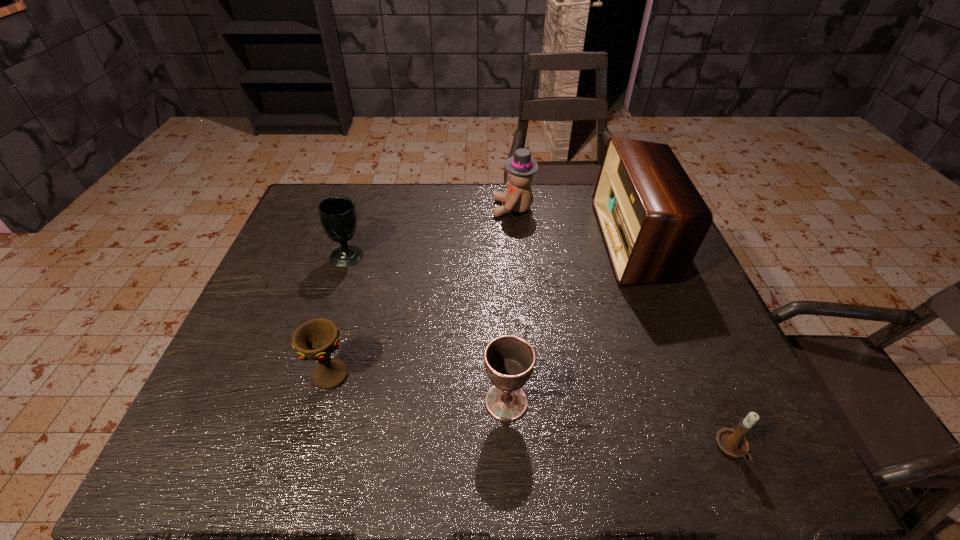
This screenshot has height=540, width=960. I want to click on vacant point located 0.310m on the front-facing side of the rag_doll, so click(x=397, y=208).

Locate an element on the screen. vacant space located 0.290m on the front-facing side of the rag_doll is located at coordinates (403, 208).

At what (x,y) coordinates should I click in order to perform the action: click on vacant area situated on the back of the farthest chalice. Please return your answer as a coordinate pair (x, y). This screenshot has width=960, height=540. Looking at the image, I should click on (363, 210).

You are a GUI agent. You are given a task and a screenshot of the screen. Output one action in this format:
    pyautogui.click(x=<x>, y=<y>)
    Task: Click on the vacant area situated 0.250m on the left of the rightmost chalice
    The height and width of the screenshot is (540, 960).
    Given the screenshot: What is the action you would take?
    pyautogui.click(x=364, y=402)

This screenshot has width=960, height=540. Find the location of `radio receiver present at the far edge`. radio receiver present at the far edge is located at coordinates (653, 220).

Identify the location of rag_doll that is positioned at the far edge. This screenshot has height=540, width=960. [520, 168].

The height and width of the screenshot is (540, 960). I want to click on object located at the near edge, so click(732, 442).

In order to click on object that is at the left edge in this screenshot , I will do `click(338, 216)`.

This screenshot has width=960, height=540. Find the location of `radio receiver present at the right edge`. radio receiver present at the right edge is located at coordinates (653, 220).

This screenshot has height=540, width=960. I want to click on candle holder positioned at the right edge, so click(x=732, y=442).